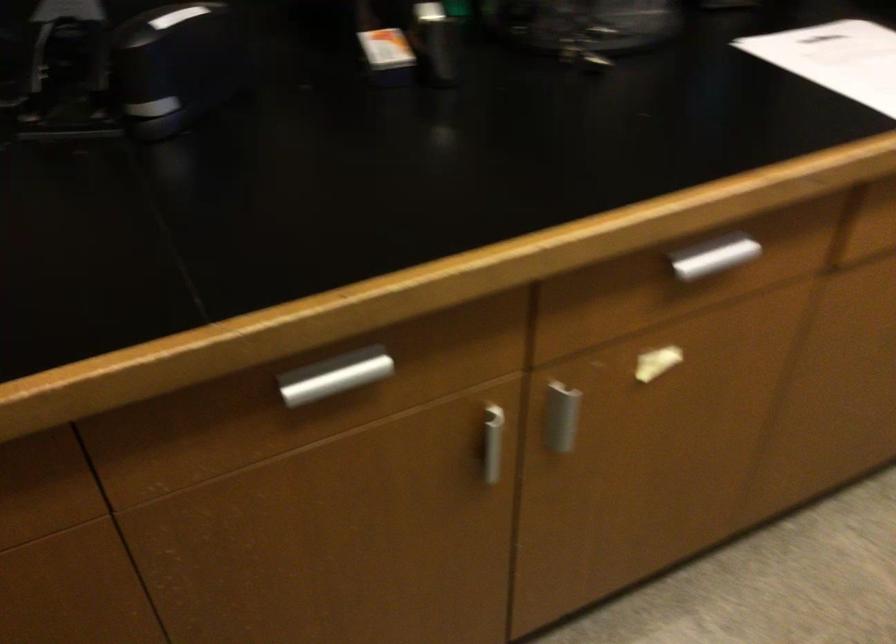
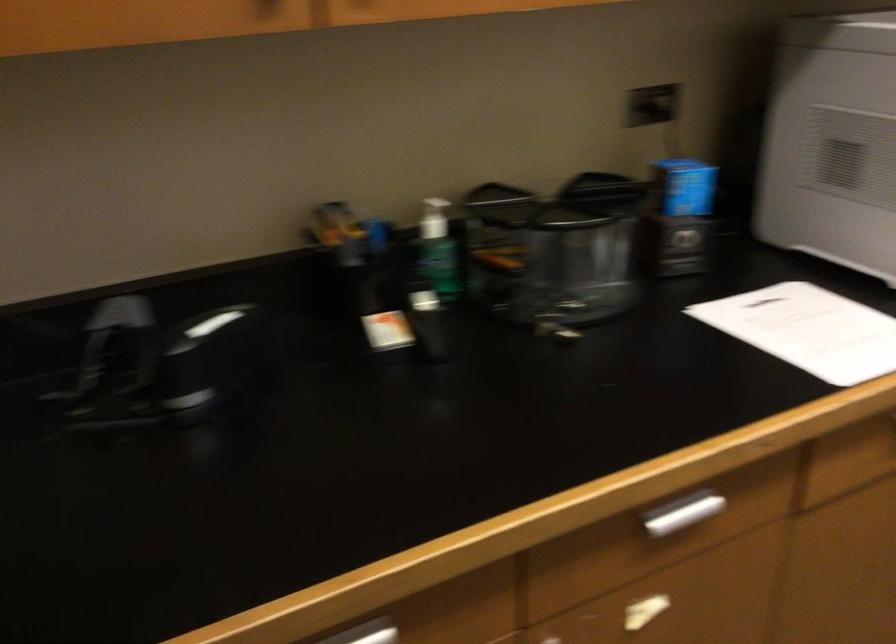
The point at (366,361) is marked in the first image. Where is the corresponding point in the second image?

(369, 630)